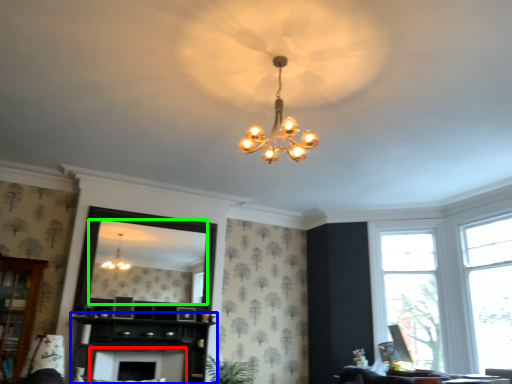
Question: Which object is the farthest from fireplace (highlighted by a red box)? Choose among these: dresser (highlighted by a blue box) or mirror (highlighted by a green box).

Choices:
 (A) dresser
 (B) mirror

Answer: (B)